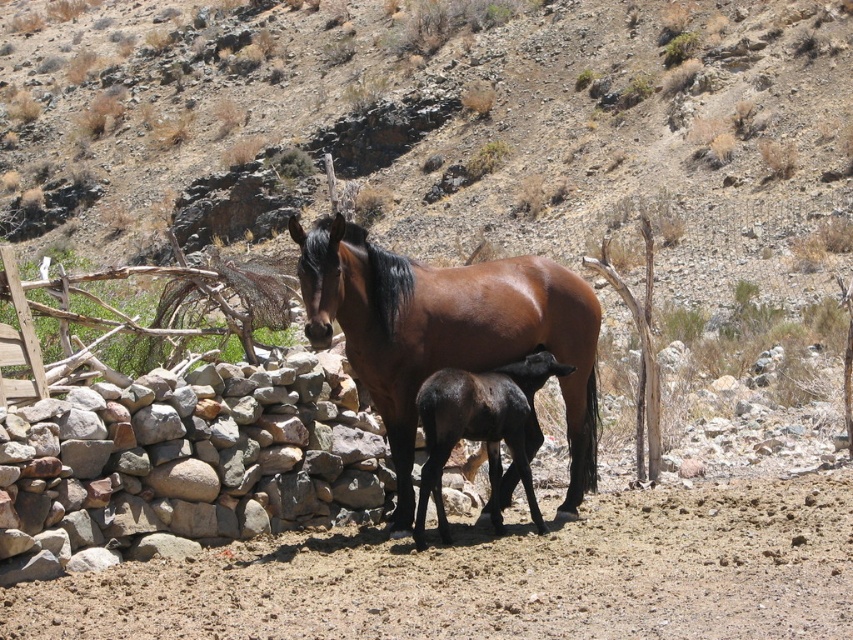
Is brown dirt field at center shorter than black glossy foal at center?

Indeed, brown dirt field at center has a lesser height compared to black glossy foal at center.

What do you see at coordinates (498, 577) in the screenshot? I see `brown dirt field at center` at bounding box center [498, 577].

Where is `brown dirt field at center`? The width and height of the screenshot is (853, 640). brown dirt field at center is located at coordinates (498, 577).

Which of these two, gray rough stone at lower left or brown glossy horse at center, stands taller?

Standing taller between the two is brown glossy horse at center.

Is gray rough stone at lower left shorter than brown glossy horse at center?

Correct, gray rough stone at lower left is not as tall as brown glossy horse at center.

I want to click on gray rough stone at lower left, so click(181, 465).

Based on the photo, can you confirm if brown dirt field at center is shorter than brown glossy horse at center?

Yes, brown dirt field at center is shorter than brown glossy horse at center.

Who is lower down, brown dirt field at center or brown glossy horse at center?

brown dirt field at center

Is point (537, 628) closer to viewer compared to point (363, 260)?

That is True.

At what (x,y) coordinates should I click in order to perform the action: click on brown dirt field at center. Please return your answer as a coordinate pair (x, y). The height and width of the screenshot is (640, 853). Looking at the image, I should click on (498, 577).